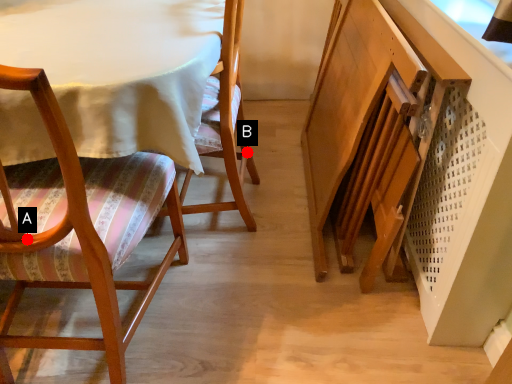
Question: Two points are circled on the image, labeled by A and B beside each circle. Which of the following is the closest to the observer?

Choices:
 (A) A is closer
 (B) B is closer

Answer: (A)